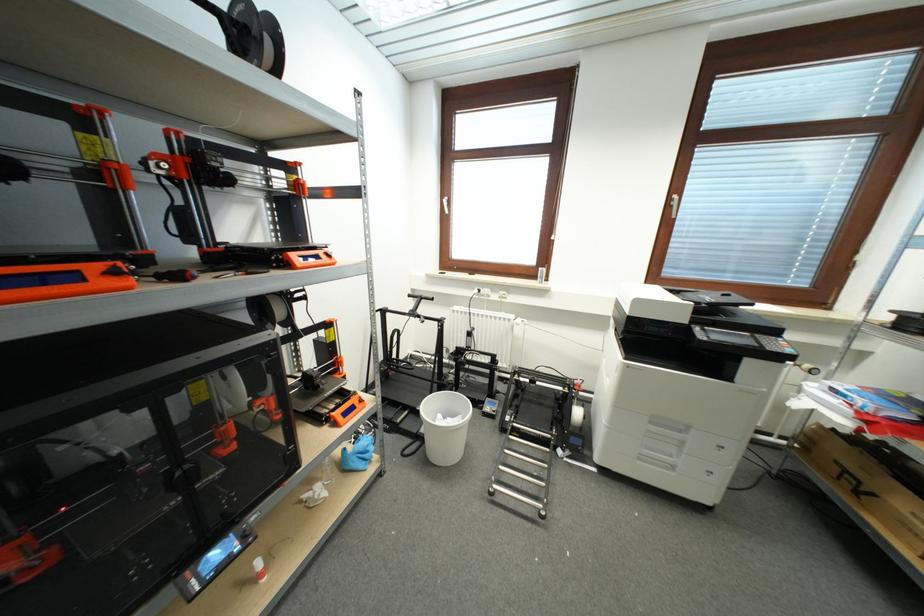
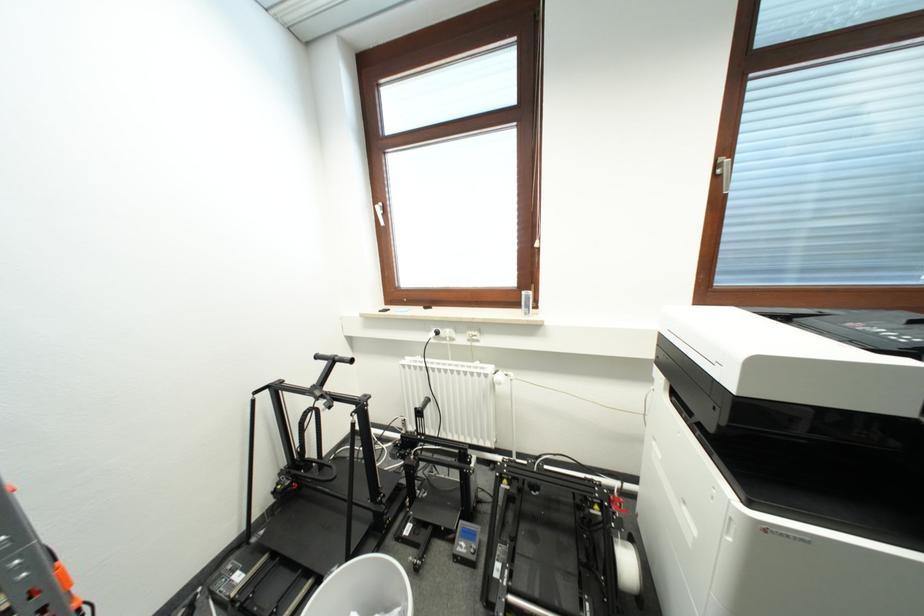
Find the pixel in the second image that matches point 446,200 in the first image.

(379, 206)